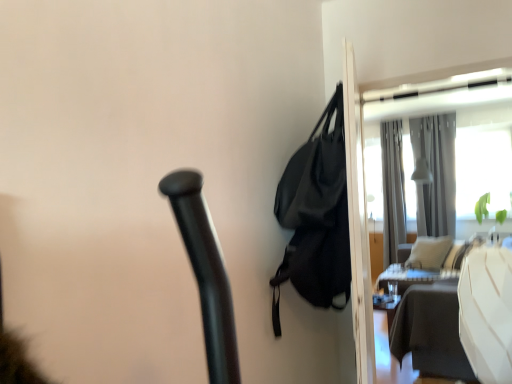
Identify the location of black matte bag at upper right. (316, 217).

The width and height of the screenshot is (512, 384). What do you see at coordinates (393, 190) in the screenshot?
I see `gray fabric curtain at upper right, which appears as the first curtain when viewed from the left` at bounding box center [393, 190].

Identify the location of white glossy table at right. The width and height of the screenshot is (512, 384). (411, 277).

Where is `black matte bag at upper right`? black matte bag at upper right is located at coordinates (316, 217).

Can you confirm if transparent glass screen door at upper right is taller than white glossy table at right?

A: Yes, transparent glass screen door at upper right is taller than white glossy table at right.

Consider the image. From the image's perspective, which object appears higher, transparent glass screen door at upper right or white glossy table at right?

transparent glass screen door at upper right, from the image's perspective.

What's the angular difference between transparent glass screen door at upper right and white glossy table at right's facing directions?

transparent glass screen door at upper right and white glossy table at right are facing 79 degrees away from each other.

Considering the positions of objects transparent glass screen door at upper right and white glossy table at right in the image provided, who is in front, transparent glass screen door at upper right or white glossy table at right?

transparent glass screen door at upper right is more forward.

Who is taller, transparent glass screen door at upper right or black matte bag at upper right?

transparent glass screen door at upper right.

Could you tell me if transparent glass screen door at upper right is facing black matte bag at upper right?

Yes, transparent glass screen door at upper right is aimed at black matte bag at upper right.

I want to click on bag in front of the transparent glass screen door at upper right, so click(316, 217).

Which curtain is the 2nd one when counting from the right side of the transparent glass screen door at upper right? Please provide its 2D coordinates.

[(435, 173)]

Which is in front, point (452, 116) or point (445, 343)?

The point (445, 343) is in front.

From a real-world perspective, between silky gray curtain at upper right, acting as the 1th curtain starting from the right, and transparent glass screen door at upper right, who is vertically higher?

In real-world perspective, silky gray curtain at upper right, acting as the 1th curtain starting from the right, is above.

Considering the points (385, 151) and (436, 303), which point is in front, point (385, 151) or point (436, 303)?

The point (436, 303) is more forward.

Can we say gray fabric curtain at upper right, which appears as the first curtain when viewed from the left, lies outside transparent glass screen door at upper right?

gray fabric curtain at upper right, which appears as the first curtain when viewed from the left, is positioned outside transparent glass screen door at upper right.

Considering the sizes of objects gray fabric curtain at upper right, which appears as the first curtain when viewed from the left, and transparent glass screen door at upper right in the image provided, who is smaller, gray fabric curtain at upper right, which appears as the first curtain when viewed from the left, or transparent glass screen door at upper right?

transparent glass screen door at upper right is smaller.

Is gray fabric curtain at upper right, which appears as the first curtain when viewed from the left, wider or thinner than transparent glass screen door at upper right?

gray fabric curtain at upper right, which appears as the first curtain when viewed from the left, is wider than transparent glass screen door at upper right.

Is white glossy table at right oriented towards black matte bag at upper right?

No.

From the image's perspective, between white glossy table at right and black matte bag at upper right, which one is located above?

black matte bag at upper right, from the image's perspective.

In the scene shown: How different are the orientations of white glossy table at right and black matte bag at upper right in degrees?

The facing directions of white glossy table at right and black matte bag at upper right are 97.5 degrees apart.

You are a GUI agent. You are given a task and a screenshot of the screen. Output one action in this format:
    pyautogui.click(x=<x>, y=<y>)
    Task: Click on the table below the black matte bag at upper right (from the image's perspective)
    The width and height of the screenshot is (512, 384).
    Given the screenshot: What is the action you would take?
    pyautogui.click(x=411, y=277)

Does silky gray curtain at upper right, acting as the 1th curtain starting from the right, have a larger size compared to gray fabric curtain at upper right, which appears as the first curtain when viewed from the left?

Indeed, silky gray curtain at upper right, acting as the 1th curtain starting from the right, has a larger size compared to gray fabric curtain at upper right, which appears as the first curtain when viewed from the left.

From the image's perspective, between silky gray curtain at upper right, positioned as the second curtain in left-to-right order, and gray fabric curtain at upper right, which appears as the first curtain when viewed from the left, who is located below?

gray fabric curtain at upper right, which appears as the first curtain when viewed from the left, appears lower in the image.

From a real-world perspective, between silky gray curtain at upper right, positioned as the second curtain in left-to-right order, and gray fabric curtain at upper right, acting as the 2th curtain starting from the right, who is vertically lower?

gray fabric curtain at upper right, acting as the 2th curtain starting from the right, from a real-world perspective.

Which is behind, point (454, 116) or point (393, 254)?

The point (393, 254) is behind.

From a real-world perspective, is black matte bag at upper right above or below transparent glass screen door at upper right?

Clearly, from a real-world perspective, black matte bag at upper right is above transparent glass screen door at upper right.

Is black matte bag at upper right turned away from transparent glass screen door at upper right?

No, black matte bag at upper right is not facing the opposite direction of transparent glass screen door at upper right.

Image resolution: width=512 pixels, height=384 pixels. I want to click on screen door below the black matte bag at upper right (from the image's perspective), so click(435, 100).

Between point (284, 212) and point (428, 101), which one is positioned behind?

Positioned behind is point (428, 101).

Where is `table on the right of the transparent glass screen door at upper right`? Image resolution: width=512 pixels, height=384 pixels. table on the right of the transparent glass screen door at upper right is located at coordinates (411, 277).

The image size is (512, 384). Find the location of `bag that appears on the left of transparent glass screen door at upper right`. bag that appears on the left of transparent glass screen door at upper right is located at coordinates (316, 217).

Considering their positions, is white glossy table at right positioned closer to black matte bag at upper right than gray fabric curtain at upper right, acting as the 2th curtain starting from the right?

The object closer to black matte bag at upper right is white glossy table at right.

Based on the photo, looking at the image, which one is located further to transparent glass screen door at upper right, silky gray curtain at upper right, acting as the 1th curtain starting from the right, or black matte bag at upper right?

Based on the image, black matte bag at upper right appears to be further to transparent glass screen door at upper right.

When comparing their distances from black matte bag at upper right, does transparent glass screen door at upper right or gray fabric curtain at upper right, acting as the 2th curtain starting from the right, seem further?

gray fabric curtain at upper right, acting as the 2th curtain starting from the right, is further to black matte bag at upper right.

Considering their positions, is transparent glass screen door at upper right positioned further to silky gray curtain at upper right, acting as the 1th curtain starting from the right, than gray fabric curtain at upper right, acting as the 2th curtain starting from the right?

transparent glass screen door at upper right.

When comparing their distances from silky gray curtain at upper right, acting as the 1th curtain starting from the right, does white glossy table at right or transparent glass screen door at upper right seem closer?

transparent glass screen door at upper right is closer to silky gray curtain at upper right, acting as the 1th curtain starting from the right.

When comparing their distances from transparent glass screen door at upper right, does silky gray curtain at upper right, positioned as the second curtain in left-to-right order, or gray fabric curtain at upper right, which appears as the first curtain when viewed from the left, seem further?

The object further to transparent glass screen door at upper right is gray fabric curtain at upper right, which appears as the first curtain when viewed from the left.

Consider the image. Based on their spatial positions, is transparent glass screen door at upper right or black matte bag at upper right further from gray fabric curtain at upper right, which appears as the first curtain when viewed from the left?

black matte bag at upper right lies further to gray fabric curtain at upper right, which appears as the first curtain when viewed from the left, than the other object.

Looking at this image, which object lies further to the anchor point gray fabric curtain at upper right, acting as the 2th curtain starting from the right, silky gray curtain at upper right, positioned as the second curtain in left-to-right order, or white glossy table at right?

white glossy table at right.

Identify the location of screen door between black matte bag at upper right and silky gray curtain at upper right, positioned as the second curtain in left-to-right order, from front to back. The image size is (512, 384). (435, 100).

You are a GUI agent. You are given a task and a screenshot of the screen. Output one action in this format:
    pyautogui.click(x=<x>, y=<y>)
    Task: Click on the table between transparent glass screen door at upper right and silky gray curtain at upper right, positioned as the second curtain in left-to-right order, in the front-back direction
    The image size is (512, 384).
    Given the screenshot: What is the action you would take?
    pyautogui.click(x=411, y=277)

What are the coordinates of `screen door between black matte bag at upper right and gray fabric curtain at upper right, acting as the 2th curtain starting from the right, in the front-back direction` in the screenshot? It's located at (435, 100).

This screenshot has height=384, width=512. Find the location of `table located between black matte bag at upper right and silky gray curtain at upper right, positioned as the second curtain in left-to-right order, in the depth direction`. table located between black matte bag at upper right and silky gray curtain at upper right, positioned as the second curtain in left-to-right order, in the depth direction is located at coordinates (411, 277).